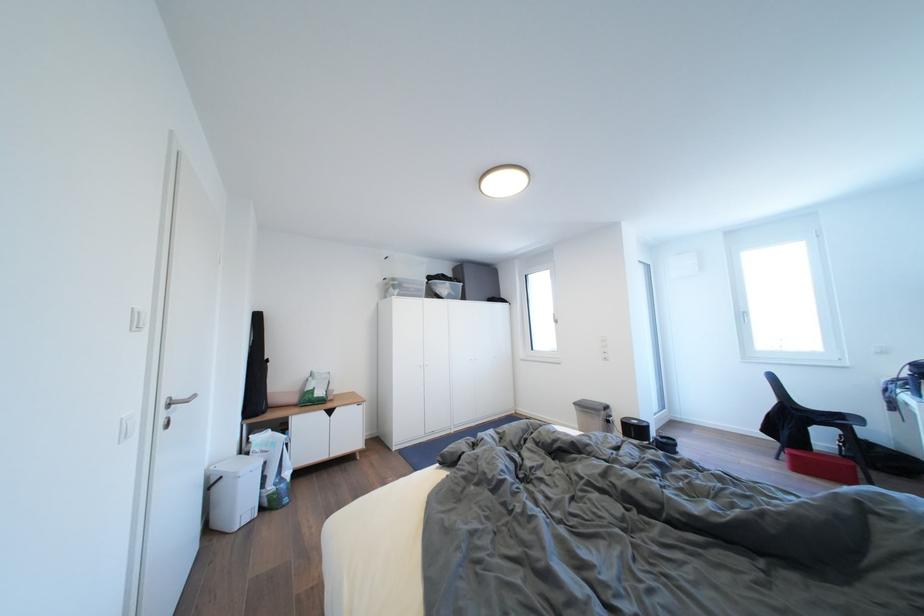
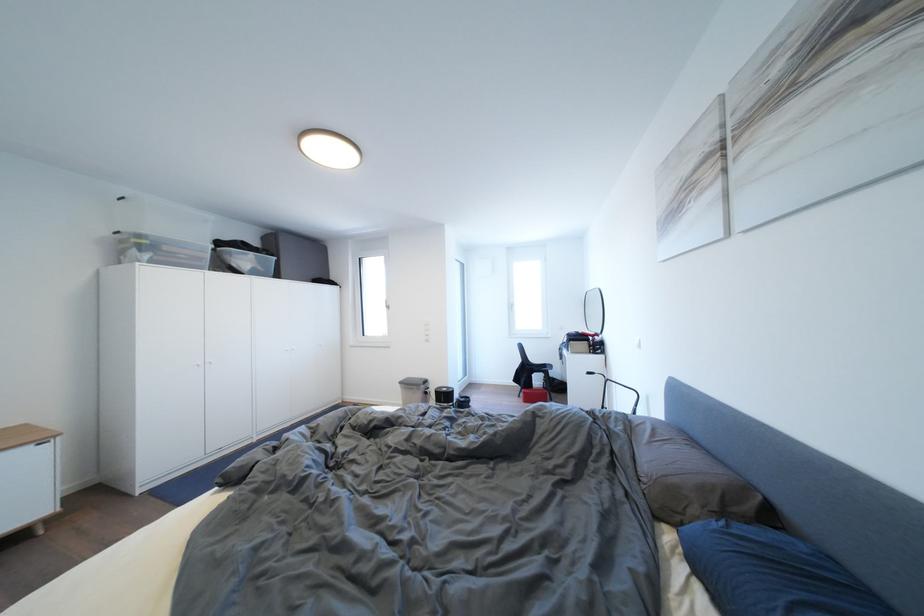
Where in the second image is the point corresponding to pixel 799 460 from the first image?

(532, 398)